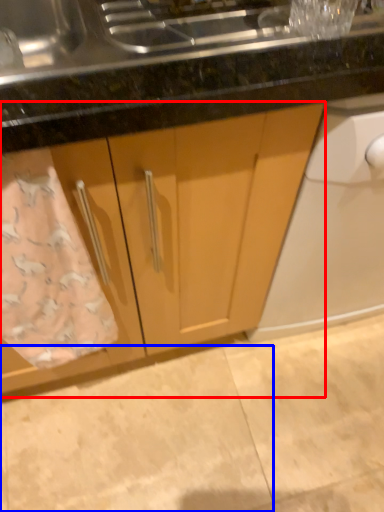
Question: Among these objects, which one is farthest to the camera, cabinetry (highlighted by a red box) or granite (highlighted by a blue box)?

Choices:
 (A) cabinetry
 (B) granite

Answer: (B)